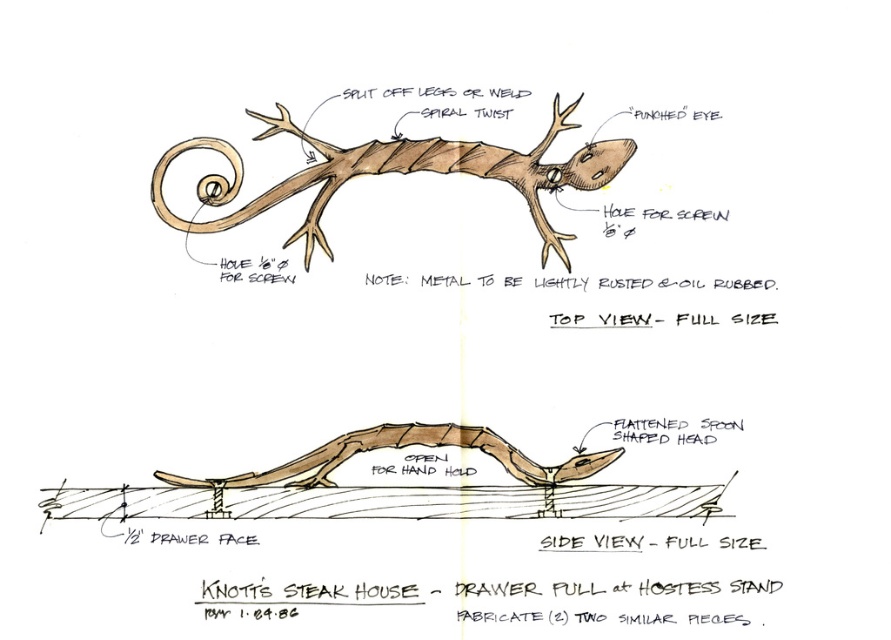
You are examining the technical drawing of the metal lizard piece. You notice two points labeled as point (323, 161) and point (257, 480). From your vantage point, which point appears closer to you?

Point (323, 161) is further to the camera than point (257, 480), so the point (257, 480) appears closer to you.

You are an artisan comparing two lizards in a technical drawing. The rustic metal lizard at center and the brown matte wood lizard at center are both shown in the top view. Which one has a larger width according to the drawing?

The rustic metal lizard at center might be wider than brown matte wood lizard at center, so the rustic metal lizard at center could have a larger width.

From the picture: You are holding a measuring tape and need to determine if the rustic metal lizard at center is within arm reach. Your arm can extend 0.9 meters. Can you reach it?

The rustic metal lizard at center is 1.06 meters away from the viewer. Since your arm can only extend 0.9 meters, you cannot reach it.